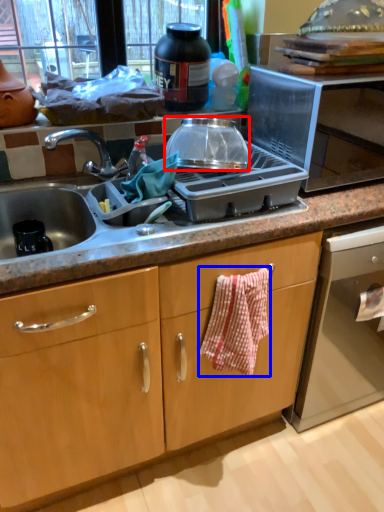
Question: Among these objects, which one is farthest to the camera, kitchen appliance (highlighted by a red box) or hand towel (highlighted by a blue box)?

Choices:
 (A) kitchen appliance
 (B) hand towel

Answer: (A)